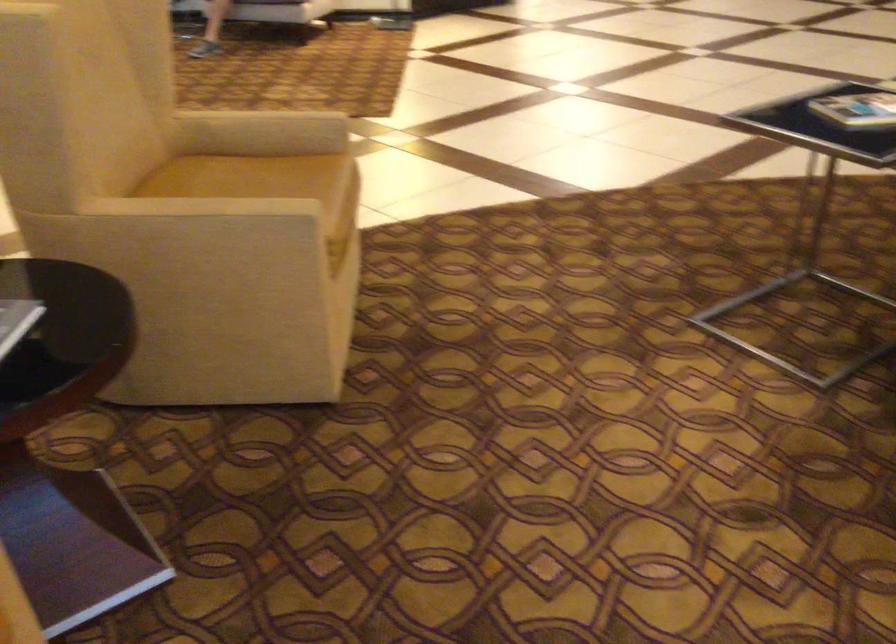
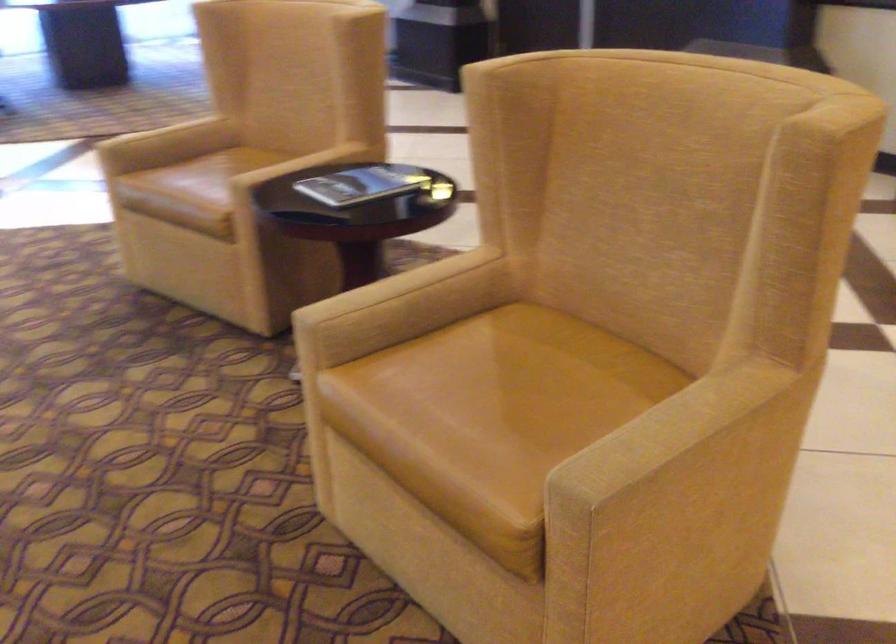
Locate, in the second image, the point that corresponds to (278,187) in the first image.

(500, 398)